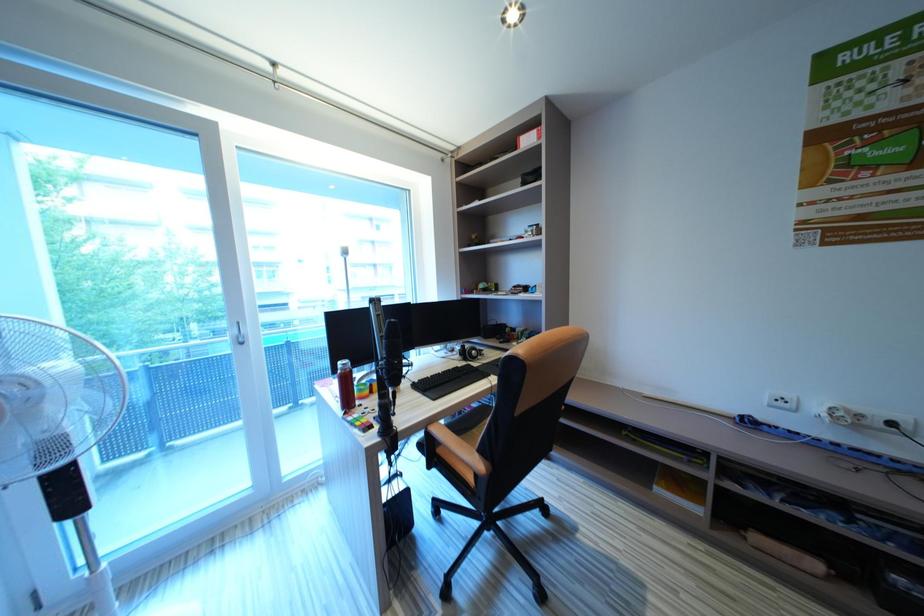
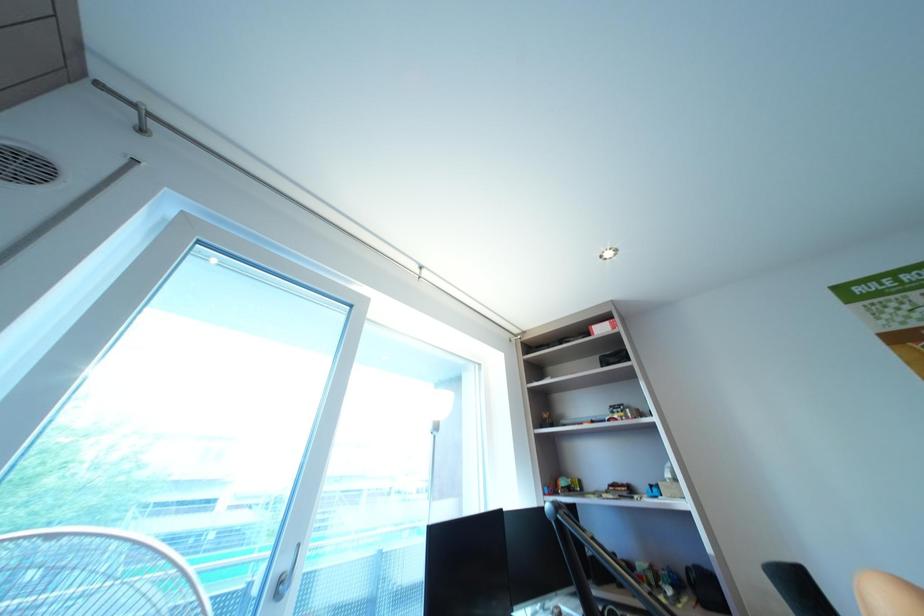
Question: Based on the continuous images, in which direction is the camera rotating? Reply with the corresponding letter.

Choices:
 (A) Left
 (B) Right
 (C) Up
 (D) Down

Answer: (C)